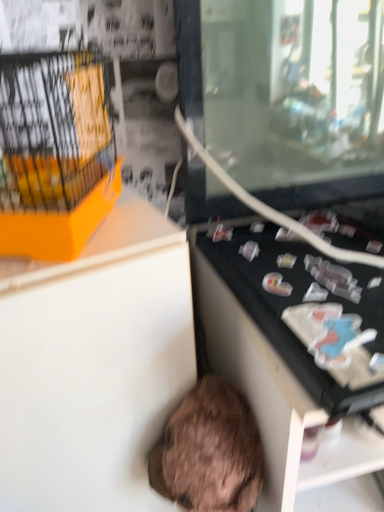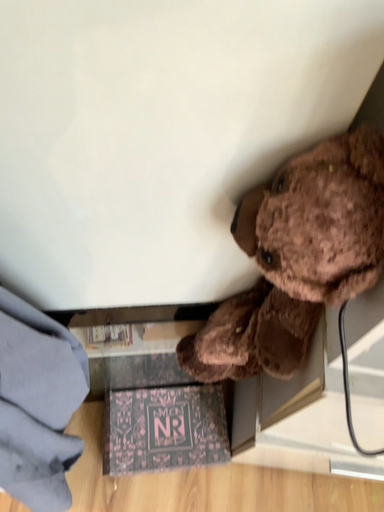
Question: Which way did the camera rotate in the video?

Choices:
 (A) rotated left
 (B) rotated right

Answer: (A)